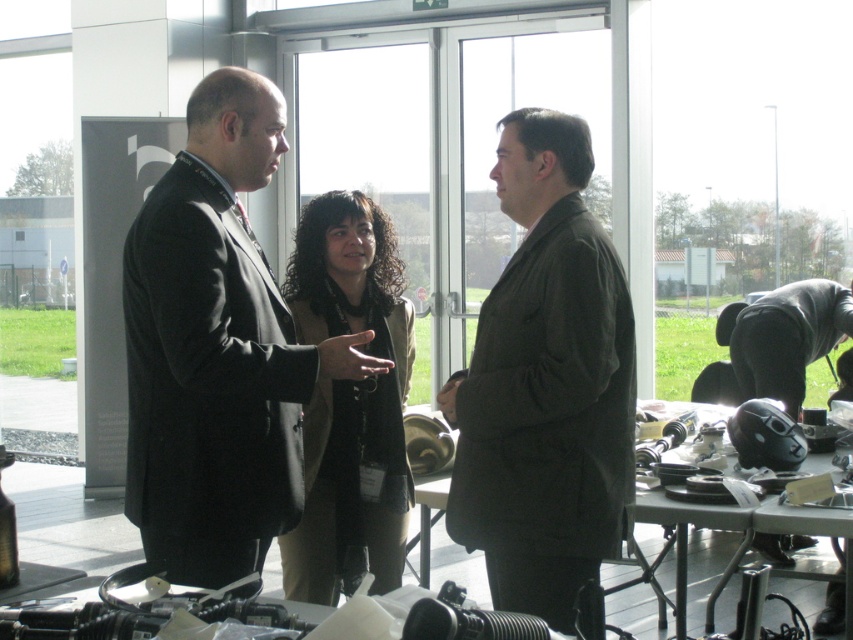
You are organizing a fashion show and need to display the matte black suit at center and the black matte helmet at right on a mannequin. Which item requires a wider base to stand stably?

The matte black suit at center requires a wider base to stand stably because its width surpasses that of the black matte helmet at right.

You are attending a conference and need to find the matte black suit at center and the black matte helmet at right. According to the scene description, which object is located to the left of the other?

The matte black suit at center is positioned on the left side of black matte helmet at right, so the matte black suit at center is to the left of the black matte helmet at right.

You are organizing a formal event and need to determine if the matte black suit at center can fit into a storage locker designed for suits with a maximum width of 40 cm. Given that the dark brown suit at center is known to fit perfectly in such lockers, what should you do?

The matte black suit at center is wider than the dark brown suit at center, which fits perfectly in the 40 cm locker. Therefore, the matte black suit at center may not fit in the same storage locker.